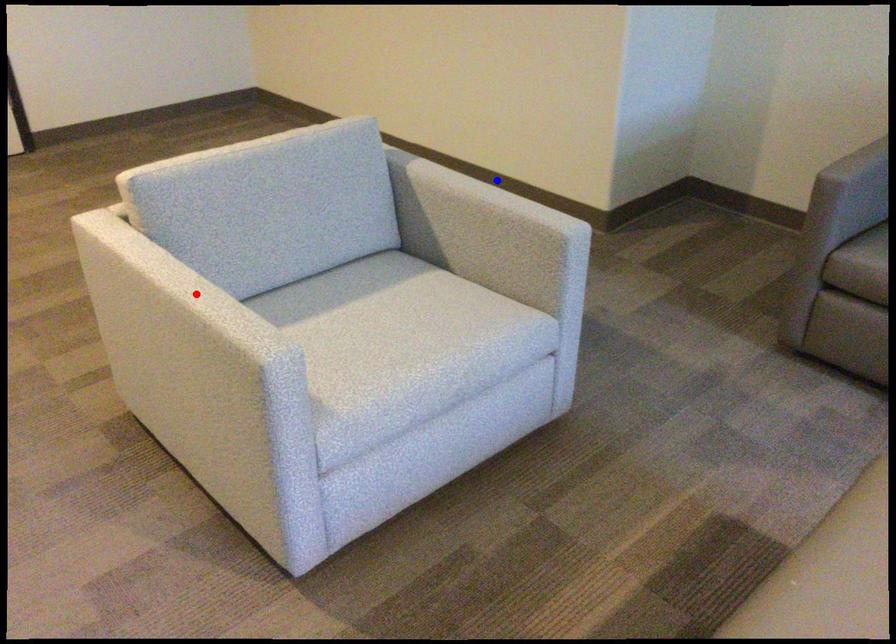
Question: Which of the two points in the image is closer to the camera?

Choices:
 (A) Blue point is closer.
 (B) Red point is closer.

Answer: (B)